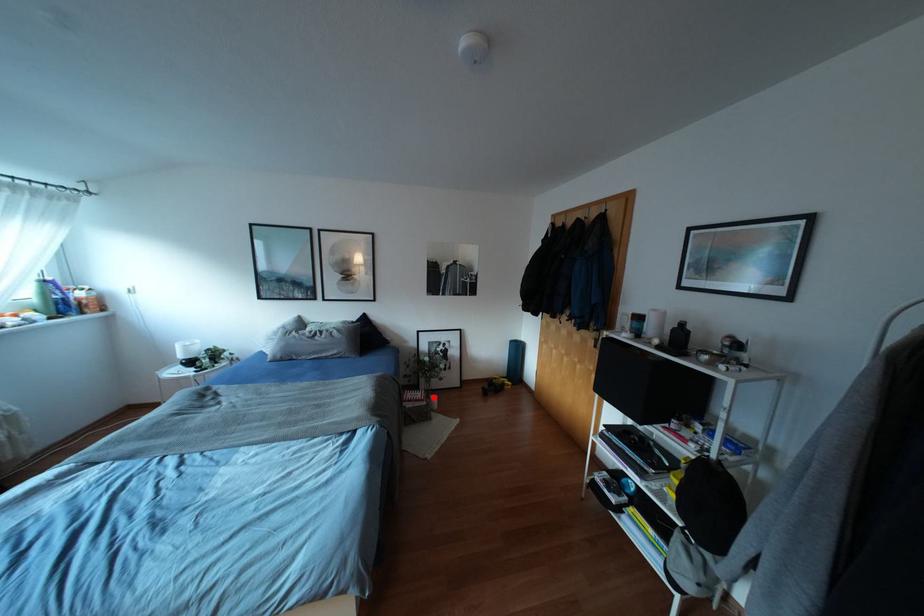
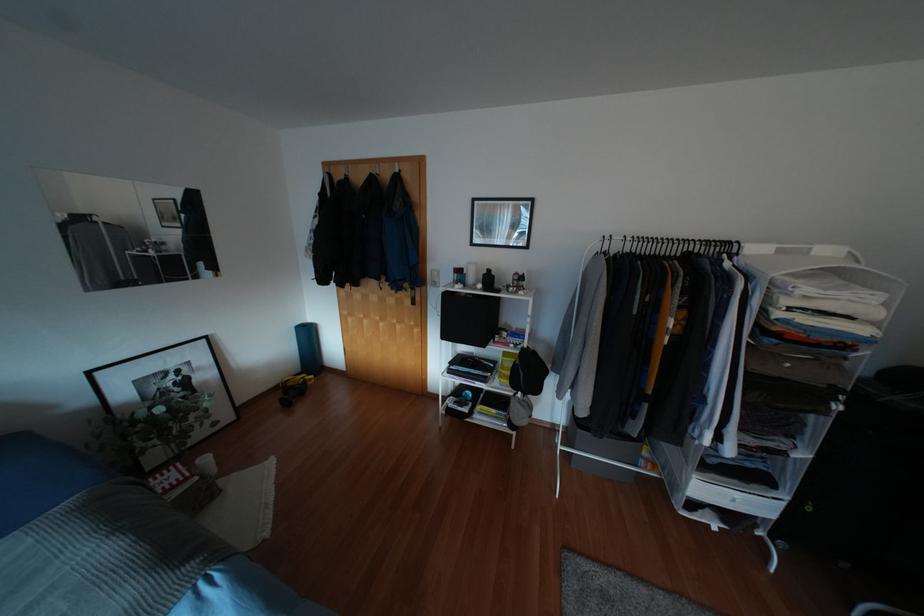
Question: I am providing you with two images of the same scene from different viewpoints. Image1 has a red point marked. In image2, the corresponding 3D location appears at what relative position? Reply with the corresponding letter.

Choices:
 (A) Closer
 (B) Farther

Answer: (A)